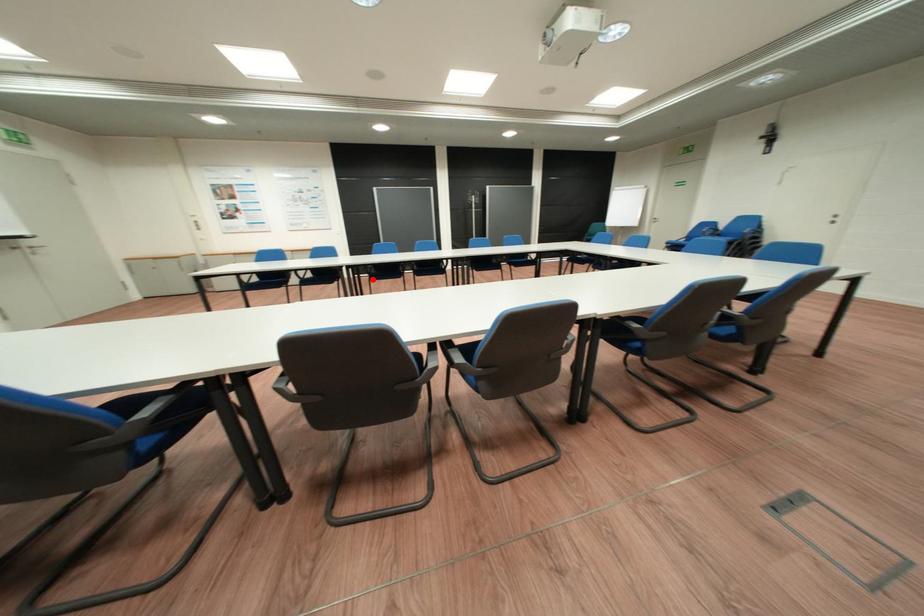
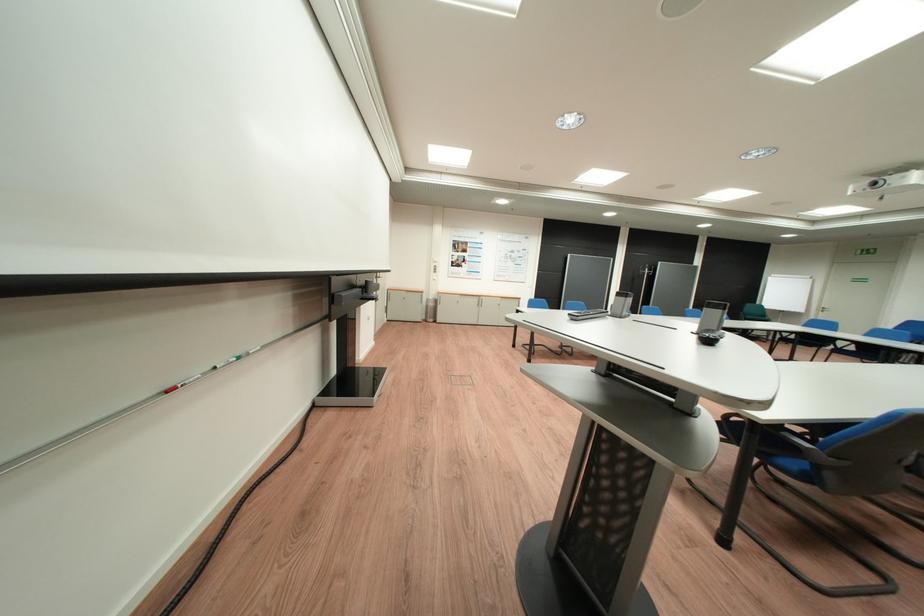
Question: I am providing you with two images of the same scene from different viewpoints. A red point is marked on the first image. Is the red point's position out of view in image 2?

Choices:
 (A) Yes
 (B) No

Answer: (A)